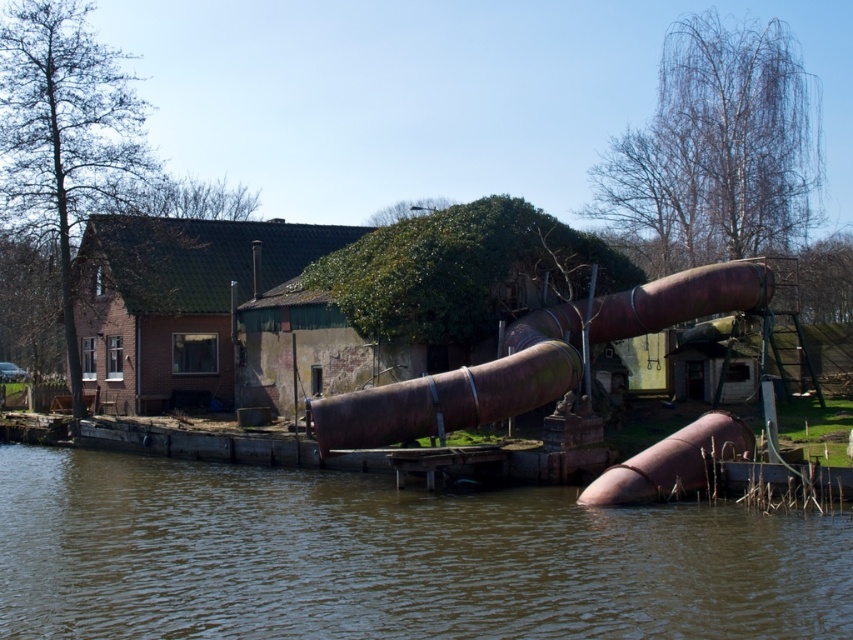
In the scene shown: Is rusty metal pipe at center further to the viewer compared to rusty metallic pipe at lower center?

Yes, it is behind rusty metallic pipe at lower center.

Does point (500, 419) come closer to viewer compared to point (679, 480)?

No, it is behind (679, 480).

This screenshot has width=853, height=640. In order to click on rusty metal pipe at center in this screenshot , I will do `click(460, 388)`.

Can you confirm if brown muddy water at lower center is shorter than rusty metallic pipe at lower center?

Indeed, brown muddy water at lower center has a lesser height compared to rusty metallic pipe at lower center.

Is point (316, 592) farther from viewer compared to point (671, 486)?

No, (316, 592) is in front of (671, 486).

Is point (653, 570) positioned behind point (676, 445)?

No, it is in front of (676, 445).

Identify the location of brown muddy water at lower center. (390, 557).

The image size is (853, 640). What do you see at coordinates (390, 557) in the screenshot? I see `brown muddy water at lower center` at bounding box center [390, 557].

Is brown muddy water at lower center further to the viewer compared to rusty metal pipe at center?

No.

Does point (827, 577) come in front of point (619, 301)?

Yes, it is in front of point (619, 301).

I want to click on brown muddy water at lower center, so click(390, 557).